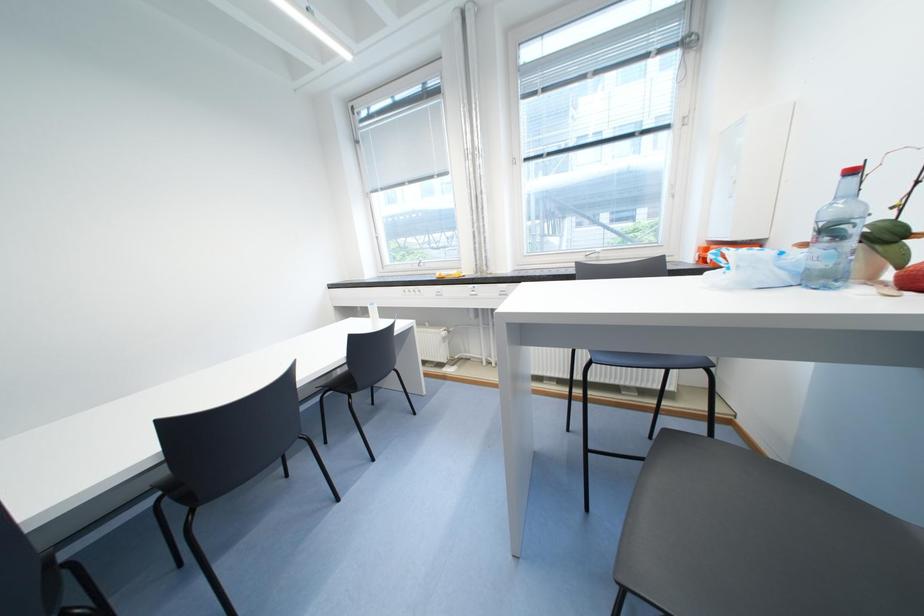
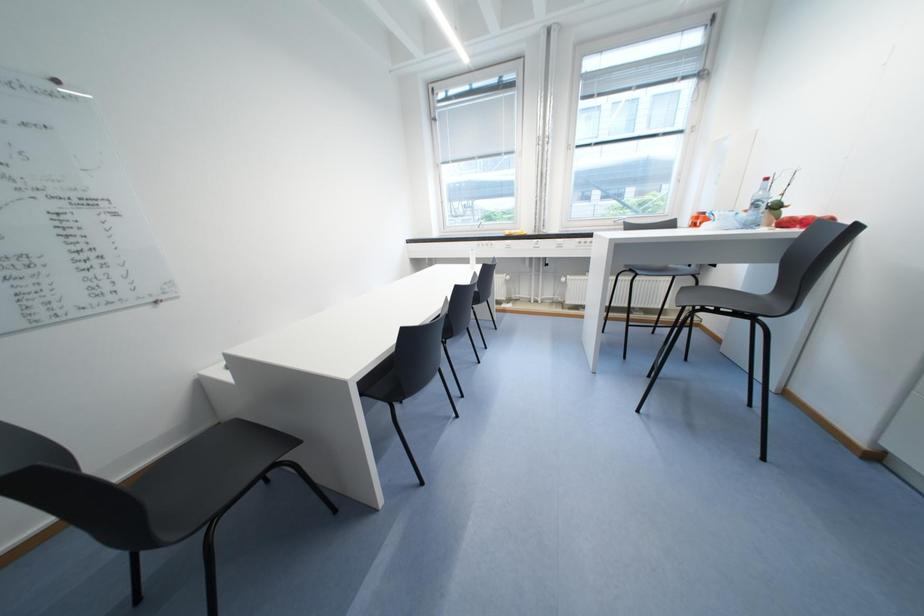
What movement of the cameraman would produce the second image?

The movement direction of the cameraman is left, backward.